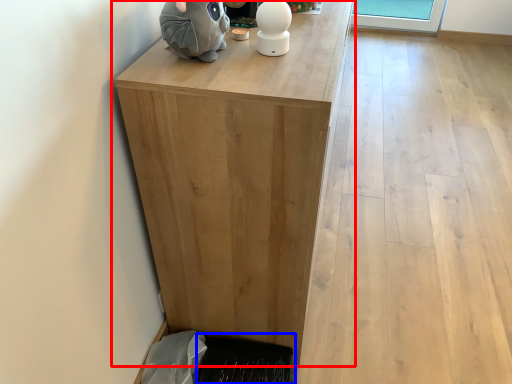
Question: Among these objects, which one is nearest to the camera, table (highlighted by a red box) or doormat (highlighted by a blue box)?

Choices:
 (A) table
 (B) doormat

Answer: (A)